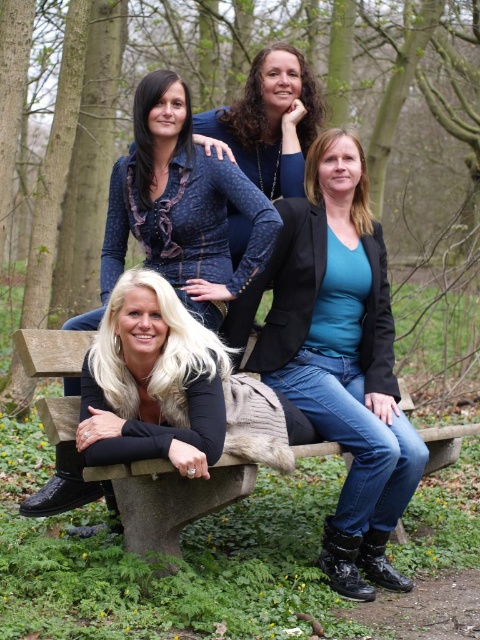
Which of these two, teal matte blazer at center or concrete bench at center, stands taller?

Standing taller between the two is teal matte blazer at center.

Which is above, teal matte blazer at center or concrete bench at center?

teal matte blazer at center is higher up.

What do you see at coordinates (345, 364) in the screenshot? I see `teal matte blazer at center` at bounding box center [345, 364].

Identify the location of teal matte blazer at center. (345, 364).

Can you confirm if black leather jacket at lower left is positioned below concrete bench at center?

Actually, black leather jacket at lower left is above concrete bench at center.

The width and height of the screenshot is (480, 640). Find the location of `black leather jacket at lower left`. black leather jacket at lower left is located at coordinates (181, 205).

What do you see at coordinates (345, 364) in the screenshot? I see `teal matte blazer at center` at bounding box center [345, 364].

I want to click on teal matte blazer at center, so click(345, 364).